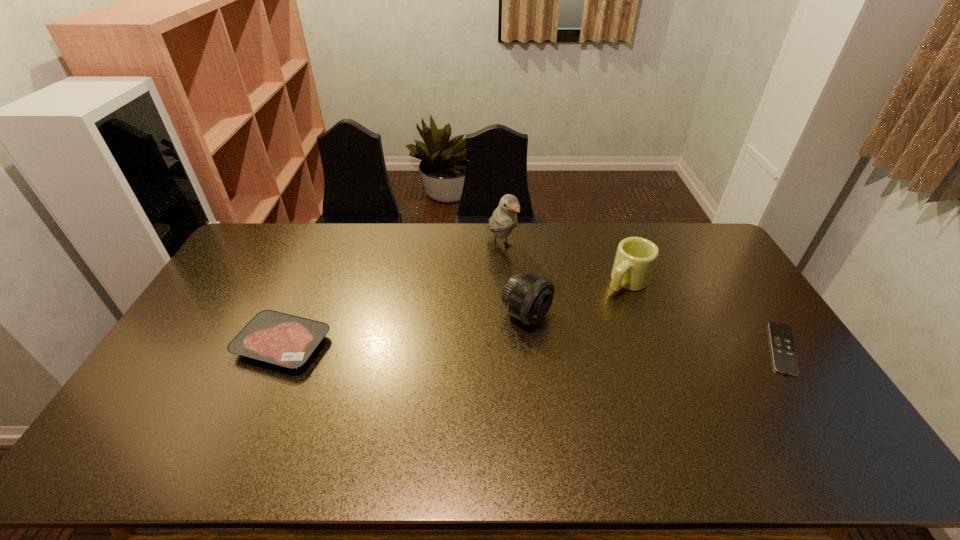
At what (x,y) coordinates should I click in order to perform the action: click on the leftmost object. Please return your answer as a coordinate pair (x, y). Looking at the image, I should click on (273, 337).

I want to click on the fourth tallest object, so click(x=273, y=337).

Where is `the rightmost object`? The width and height of the screenshot is (960, 540). the rightmost object is located at coordinates (784, 356).

Identify the location of remote control. This screenshot has height=540, width=960. 784,356.

Image resolution: width=960 pixels, height=540 pixels. What are the coordinates of `the tallest object` in the screenshot? It's located at (504, 219).

You are a GUI agent. You are given a task and a screenshot of the screen. Output one action in this format:
    pyautogui.click(x=<x>, y=<y>)
    Task: Click on the bird
    The image size is (960, 540).
    Given the screenshot: What is the action you would take?
    pyautogui.click(x=504, y=219)

You are a GUI agent. You are given a task and a screenshot of the screen. Output one action in this format:
    pyautogui.click(x=<x>, y=<y>)
    Task: Click on the fourth object from left to right
    This screenshot has height=540, width=960.
    Given the screenshot: What is the action you would take?
    pyautogui.click(x=636, y=257)

In order to click on telephoto lens in this screenshot , I will do `click(528, 297)`.

Locate an element on the screen. Image resolution: width=960 pixels, height=540 pixels. vacant region located 0.340m on the back of the steak is located at coordinates 324,252.

Find the location of a particular element. The height and width of the screenshot is (540, 960). vacant point located 0.210m on the back of the remote control is located at coordinates (736, 279).